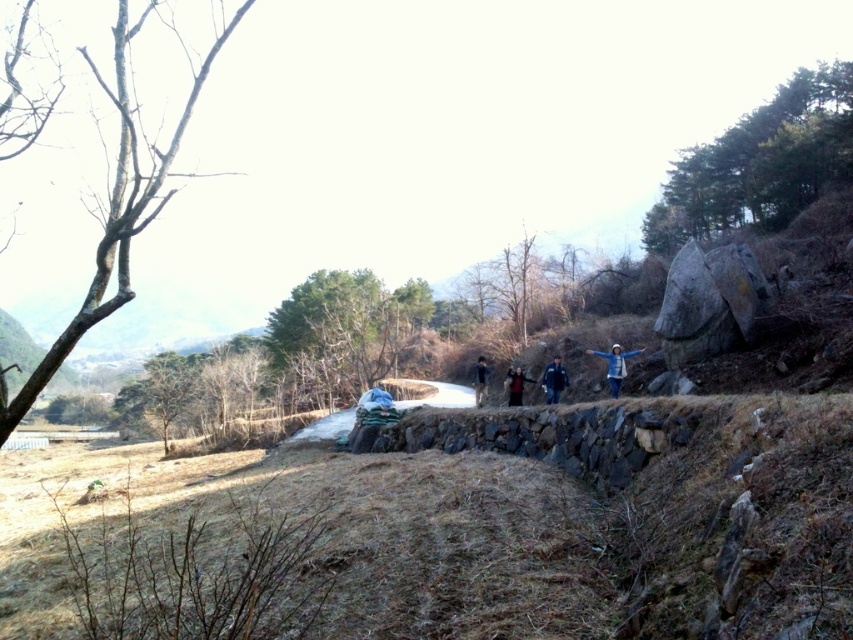
Question: Is blue fabric person at center-right below dark red fabric jacket at center?

Choices:
 (A) no
 (B) yes

Answer: (A)

Question: Which of the following is the closest to the observer?

Choices:
 (A) (512, 380)
 (B) (622, 380)

Answer: (B)

Question: Can you confirm if blue fabric person at center-right is positioned above blue fabric jacket at center?

Choices:
 (A) yes
 (B) no

Answer: (A)

Question: Can you confirm if blue fabric jacket at center is positioned to the right of dark blue jacket at center?

Choices:
 (A) no
 (B) yes

Answer: (B)

Question: Which object is closer to the camera taking this photo?

Choices:
 (A) dark red fabric jacket at center
 (B) dark blue jacket at center
 (C) blue fabric person at center-right
 (D) blue fabric jacket at center

Answer: (C)

Question: Which of the following is the farthest from the observer?

Choices:
 (A) (552, 380)
 (B) (479, 358)
 (C) (527, 378)
 (D) (622, 378)

Answer: (C)